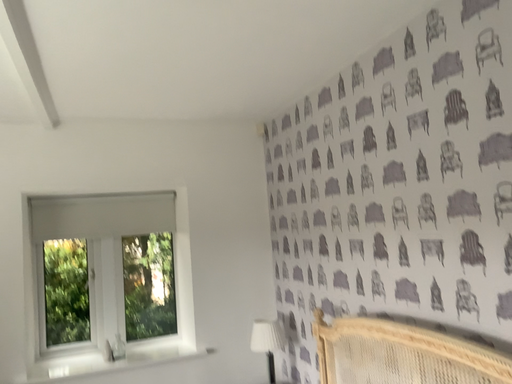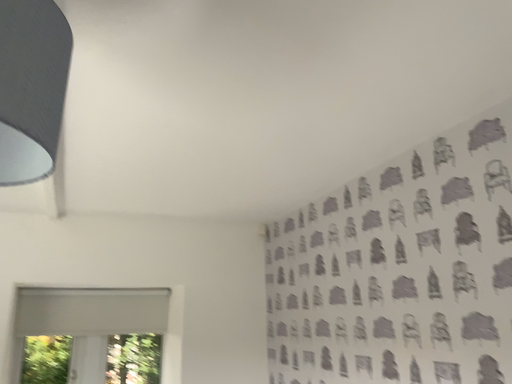
Question: How did the camera likely rotate when shooting the video?

Choices:
 (A) rotated upward
 (B) rotated downward

Answer: (A)